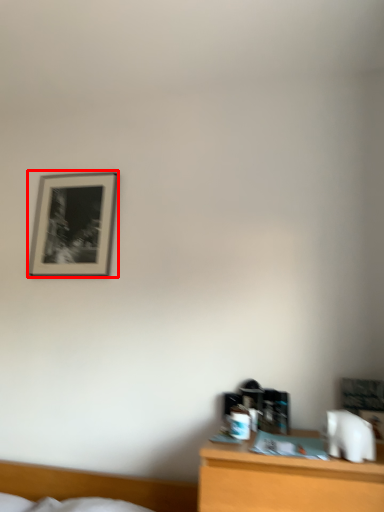
Question: From the image's perspective, considering the relative positions of picture frame (annotated by the red box) and bed in the image provided, where is picture frame (annotated by the red box) located with respect to the staircase?

Choices:
 (A) above
 (B) below

Answer: (A)